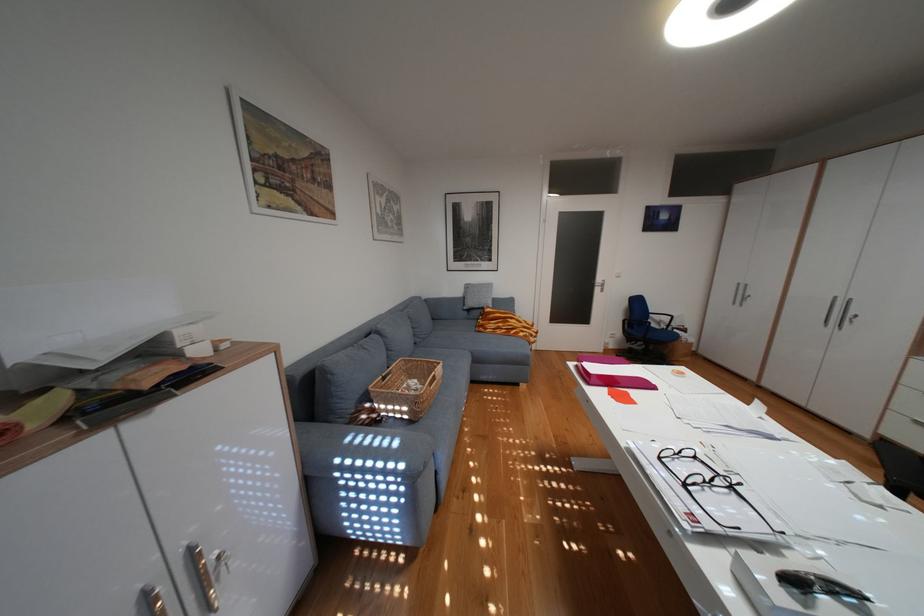
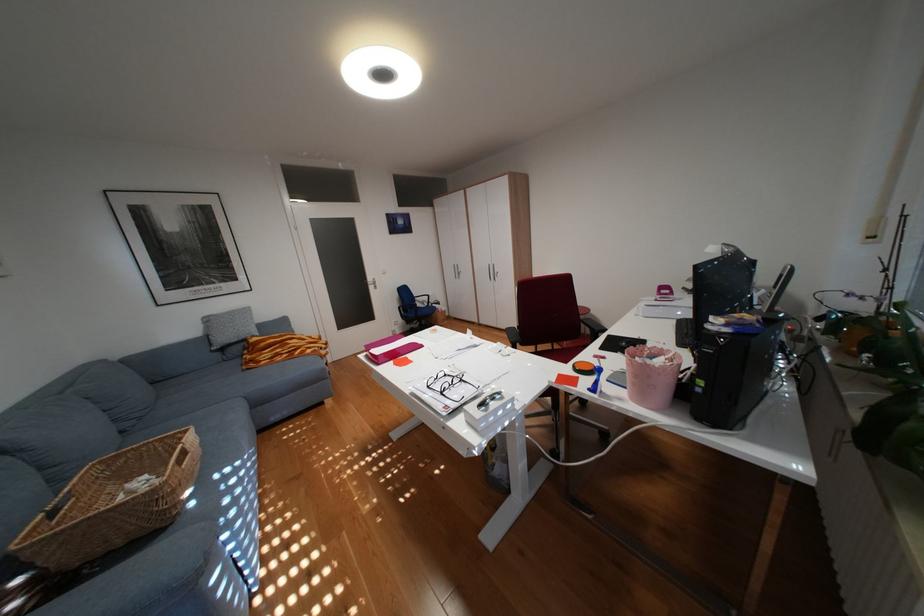
Find the pixel in the second image that matches point (582, 363) in the first image.

(373, 355)